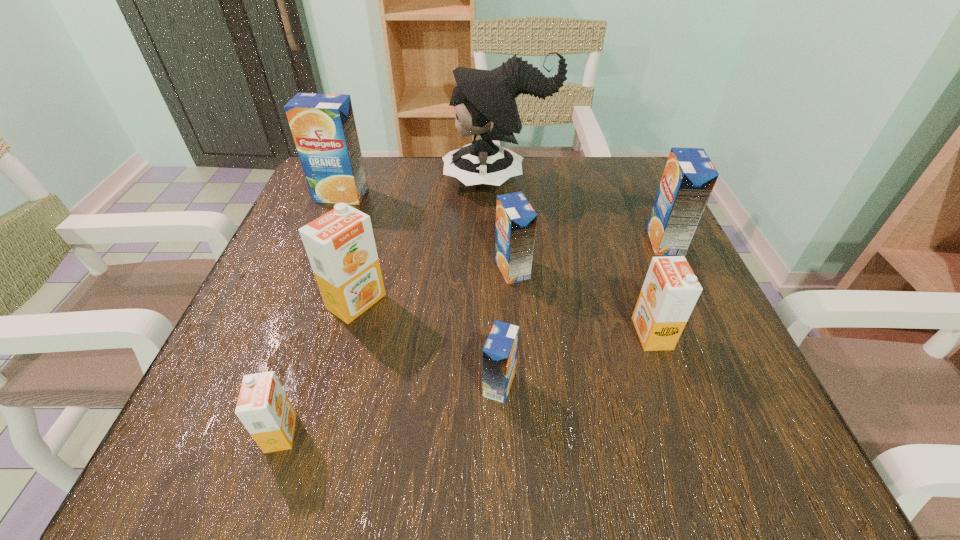
I want to click on free spot that satisfies the following two spatial constraints: 1. on the back side of the biggest orange orange juice; 2. on the right side of the rightmost blue orange_juice, so click(372, 241).

The width and height of the screenshot is (960, 540). Identify the location of vacant space that satisfies the following two spatial constraints: 1. on the back side of the second smallest blue orange_juice; 2. on the right side of the rightmost blue orange_juice. (510, 241).

Image resolution: width=960 pixels, height=540 pixels. I want to click on free space that satisfies the following two spatial constraints: 1. on the front side of the biggest orange orange juice; 2. on the right side of the farthest blue orange_juice, so click(x=299, y=301).